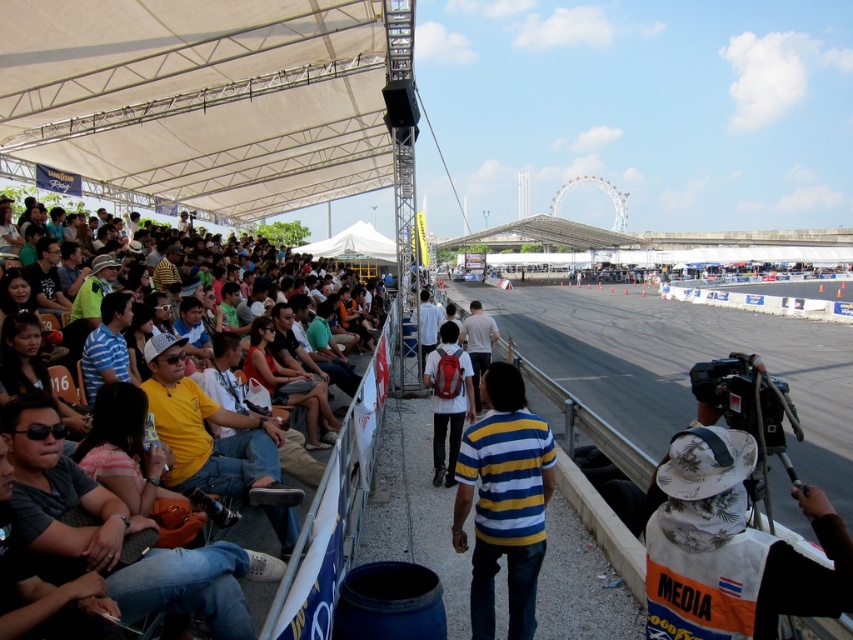
Is yellow striped shirt at center positioned behind white matte backpack at center?

No, yellow striped shirt at center is in front of white matte backpack at center.

Is point (490, 378) behind point (434, 480)?

That is False.

You are a GUI agent. You are given a task and a screenshot of the screen. Output one action in this format:
    pyautogui.click(x=<x>, y=<y>)
    Task: Click on the yellow striped shirt at center
    
    Given the screenshot: What is the action you would take?
    pyautogui.click(x=503, y=500)

Which is more to the left, matte yellow shirt at left or white matte backpack at center?

Positioned to the left is matte yellow shirt at left.

Can you confirm if matte yellow shirt at left is positioned to the left of white matte backpack at center?

Correct, you'll find matte yellow shirt at left to the left of white matte backpack at center.

Describe the element at coordinates (300, 461) in the screenshot. This screenshot has height=640, width=853. I see `matte yellow shirt at left` at that location.

Find the location of a particular element. The image size is (853, 640). matte yellow shirt at left is located at coordinates (300, 461).

Is point (350, 392) positioned after point (260, 346)?

Yes.

Can you confirm if matte yellow shirt at left is thinner than matte black shirt at center?

No.

Is point (384, 360) farther from camera compared to point (253, 321)?

That is True.

Find the location of a particular element. The image size is (853, 640). matte yellow shirt at left is located at coordinates 300,461.